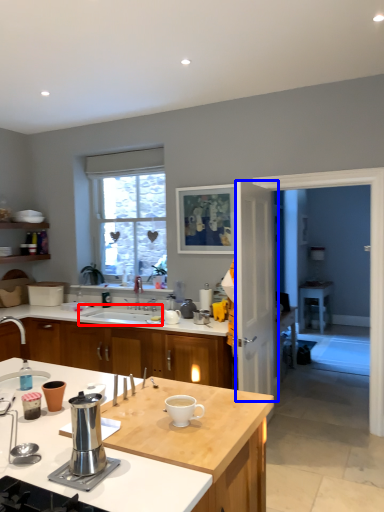
Question: Which object is further to the camera taking this photo, sink (highlighted by a red box) or screen door (highlighted by a blue box)?

Choices:
 (A) sink
 (B) screen door

Answer: (A)